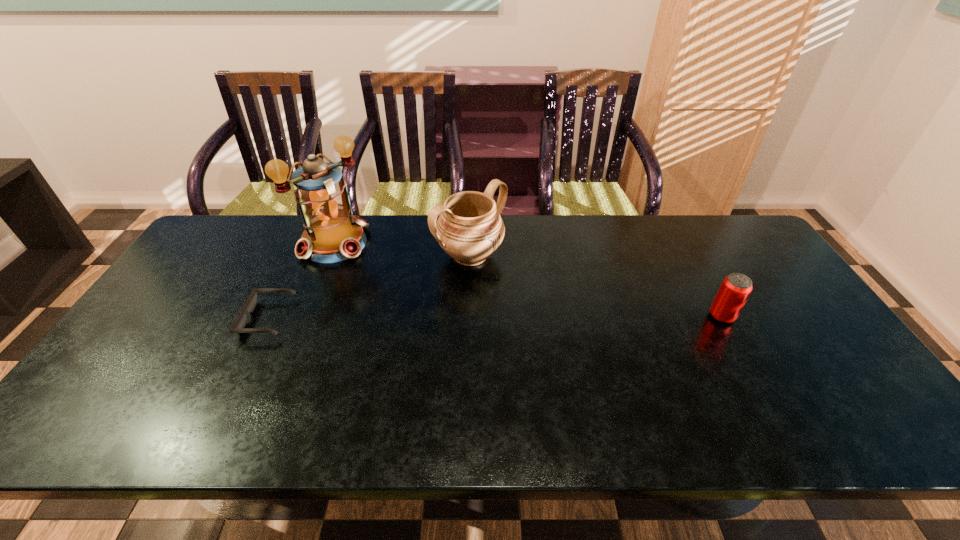
The image size is (960, 540). Identify the location of vacant space on the desktop that is between the shortest object and the rightmost object and is positioned on the front-facing side of the lantern. (428, 318).

Where is `free space on the desktop that is between the shortest object and the rightmost object and is positioned on the front-facing side of the second object from right to left`? free space on the desktop that is between the shortest object and the rightmost object and is positioned on the front-facing side of the second object from right to left is located at coordinates (553, 317).